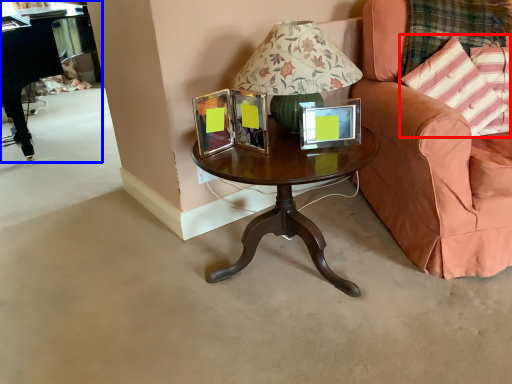
Question: Among these objects, which one is nearest to the camera, pillow (highlighted by a red box) or piano (highlighted by a blue box)?

Choices:
 (A) pillow
 (B) piano

Answer: (A)